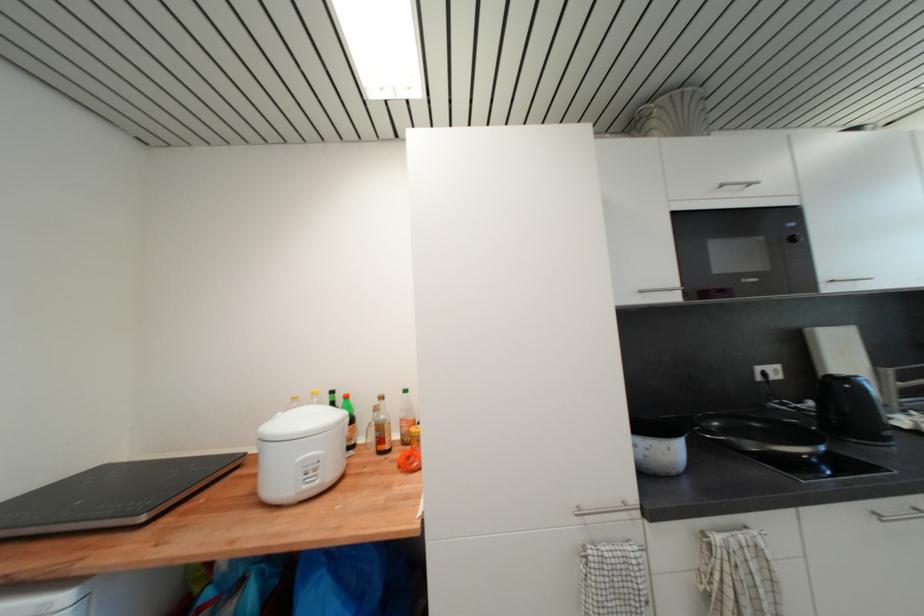
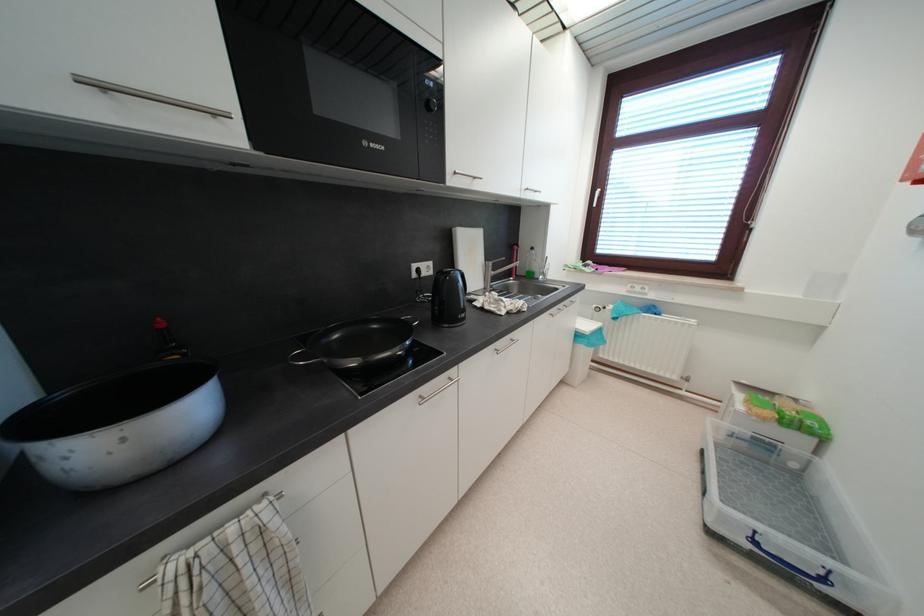
The first image is from the beginning of the video and the second image is from the end. How did the camera likely rotate when shooting the video?

The rotation direction of the camera is right-down.